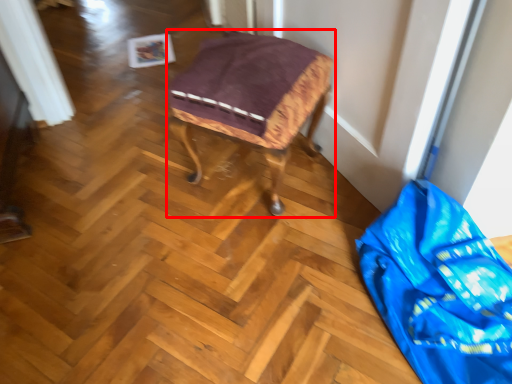
Question: From the image, what is the correct spatial relationship of furniture (annotated by the red box) in relation to material?

Choices:
 (A) right
 (B) left

Answer: (B)